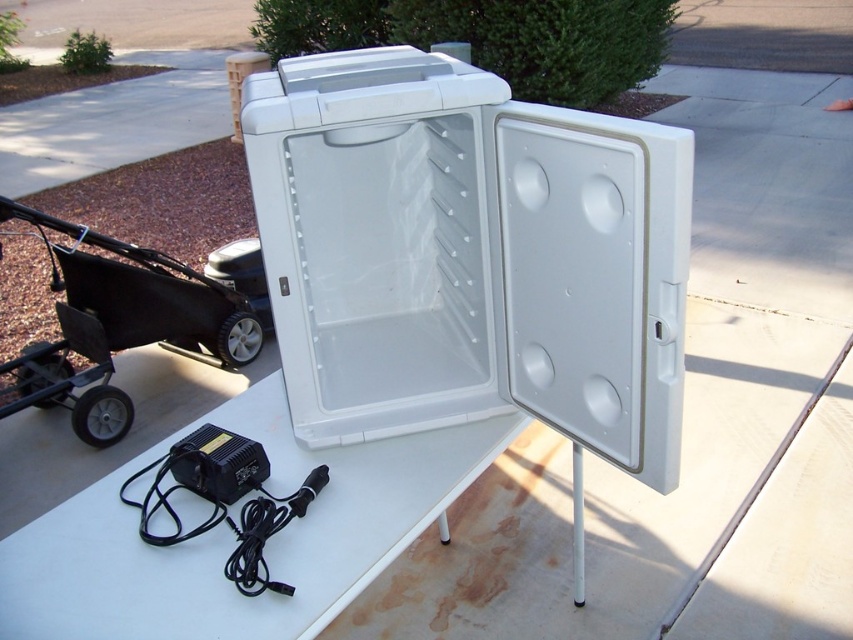
Is white plastic table at center taller than black plastic baby carriage at lower left?

No, white plastic table at center is not taller than black plastic baby carriage at lower left.

Consider the image. Is white plastic table at center wider than black plastic baby carriage at lower left?

No.

Who is more forward, (78, 632) or (131, 403)?

Point (78, 632)

Locate an element on the screen. Image resolution: width=853 pixels, height=640 pixels. white plastic table at center is located at coordinates (233, 540).

Describe the element at coordinates (468, 256) in the screenshot. I see `white plastic cooler at center` at that location.

Can you confirm if white plastic cooler at center is positioned above black plastic baby carriage at lower left?

Yes.

Does point (489, 307) come behind point (229, 321)?

That is False.

Locate an element on the screen. The width and height of the screenshot is (853, 640). white plastic cooler at center is located at coordinates (468, 256).

Between point (260, 150) and point (177, 506), which one is positioned behind?

The point (177, 506) is more distant.

Can you confirm if white plastic cooler at center is wider than white plastic table at center?

In fact, white plastic cooler at center might be narrower than white plastic table at center.

Locate an element on the screen. The width and height of the screenshot is (853, 640). white plastic cooler at center is located at coordinates (468, 256).